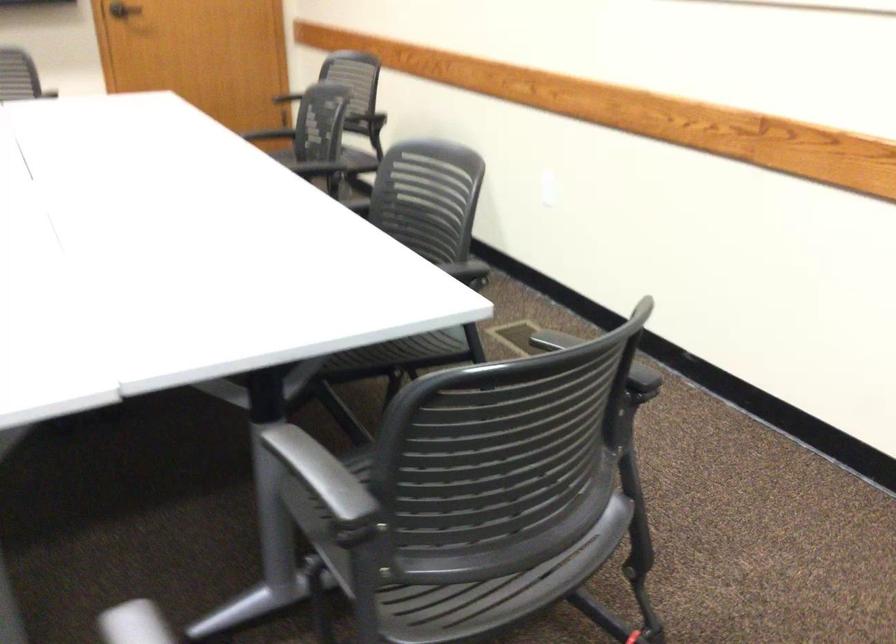
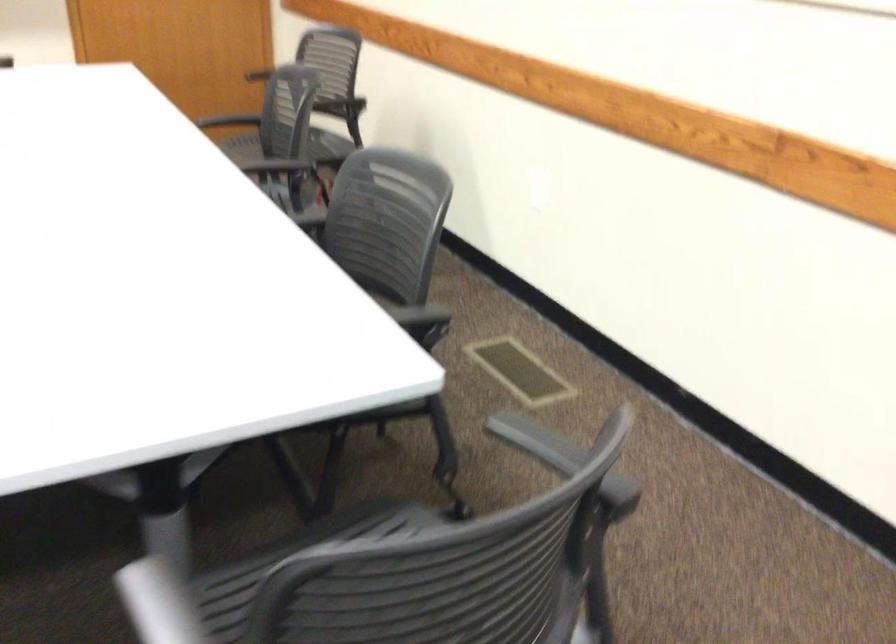
In the second image, find the point that corresponds to (263,134) in the first image.

(228, 120)